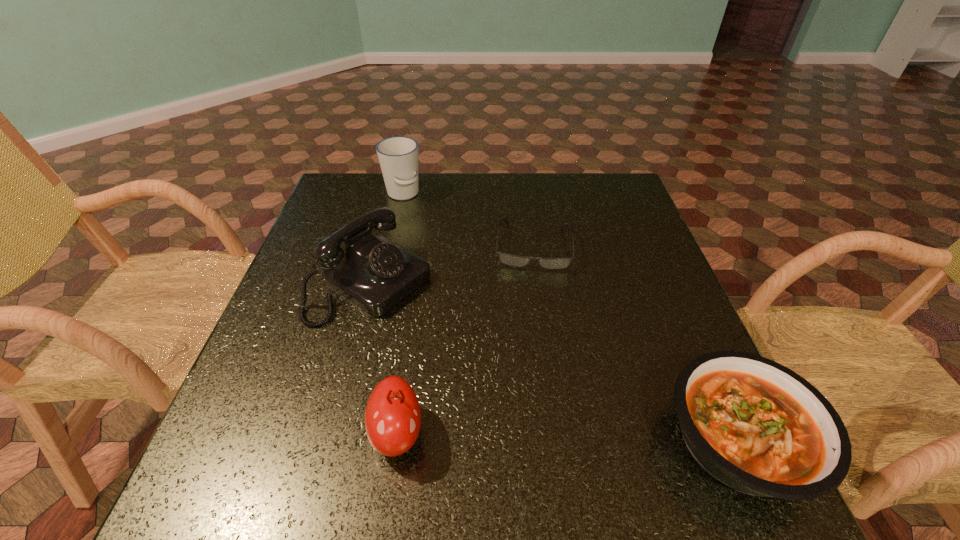
In the image, there is a desktop. Where is `vacant area at the far right corner`? The image size is (960, 540). vacant area at the far right corner is located at coordinates (583, 205).

Locate an element on the screen. This screenshot has height=540, width=960. vacant point located between the cup and the fourth tallest object is located at coordinates (570, 318).

At what (x,y) coordinates should I click in order to perform the action: click on free space between the apple and the cup. Please return your answer as a coordinate pair (x, y). Image resolution: width=960 pixels, height=540 pixels. Looking at the image, I should click on (400, 314).

What are the coordinates of `free spot between the telephone and the stew` in the screenshot? It's located at (555, 362).

Where is `empty space that is in between the rightmost object and the telephone`? Image resolution: width=960 pixels, height=540 pixels. empty space that is in between the rightmost object and the telephone is located at coordinates (555, 362).

Find the location of a particular element. This screenshot has height=540, width=960. vacant area between the farthest object and the spectacles is located at coordinates (468, 220).

Locate an element on the screen. This screenshot has width=960, height=540. free spot between the apple and the telephone is located at coordinates (384, 359).

The height and width of the screenshot is (540, 960). I want to click on unoccupied area between the cup and the stew, so click(x=570, y=318).

Where is `free space between the stew and the second object from right to left`? Image resolution: width=960 pixels, height=540 pixels. free space between the stew and the second object from right to left is located at coordinates (636, 344).

The image size is (960, 540). What are the coordinates of `free space that is in between the spectacles and the stew` in the screenshot? It's located at (636, 344).